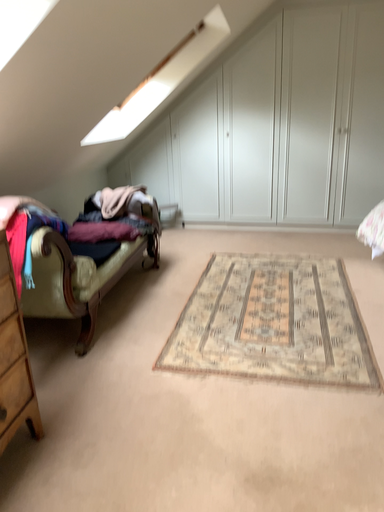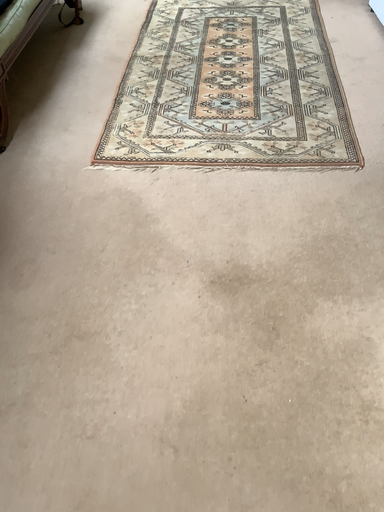
Question: How did the camera likely rotate when shooting the video?

Choices:
 (A) rotated downward
 (B) rotated upward

Answer: (A)